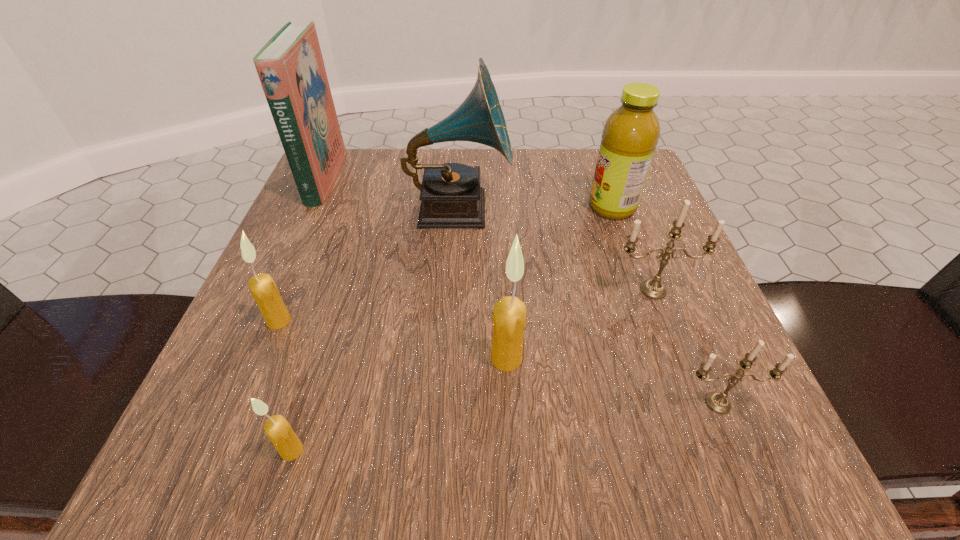
I want to click on object present at the far right corner, so click(x=630, y=135).

Where is `object positioned at the near right corner`? The width and height of the screenshot is (960, 540). object positioned at the near right corner is located at coordinates (718, 402).

This screenshot has width=960, height=540. Find the location of `blank space at the far edge`. blank space at the far edge is located at coordinates (385, 206).

I want to click on vacant space at the near edge of the desktop, so click(398, 431).

Find the location of `free location at the left edge`. free location at the left edge is located at coordinates (305, 272).

In the image, there is a desktop. In order to click on free space at the right edge in this screenshot , I will do `click(688, 270)`.

The image size is (960, 540). Find the location of `free space at the far left corner of the desktop`. free space at the far left corner of the desktop is located at coordinates (348, 182).

You are a GUI agent. You are given a task and a screenshot of the screen. Output one action in this format:
    pyautogui.click(x=<x>, y=<y>)
    Task: Click on the vacant region at the near right corner
    The width and height of the screenshot is (960, 540).
    Given the screenshot: What is the action you would take?
    pyautogui.click(x=678, y=415)

Where is `free space between the hardback book and the nearest cream candle`? This screenshot has width=960, height=540. free space between the hardback book and the nearest cream candle is located at coordinates (308, 315).

Where is `free spot between the fourth farthest candle and the hardback book`? This screenshot has width=960, height=540. free spot between the fourth farthest candle and the hardback book is located at coordinates (521, 291).